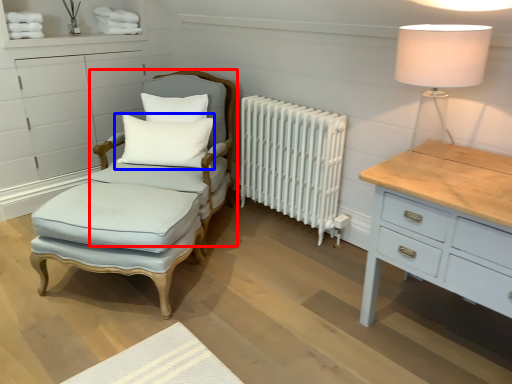
Question: Which object appears closest to the camera in this image, swivel chair (highlighted by a red box) or pillow (highlighted by a blue box)?

Choices:
 (A) swivel chair
 (B) pillow

Answer: (A)